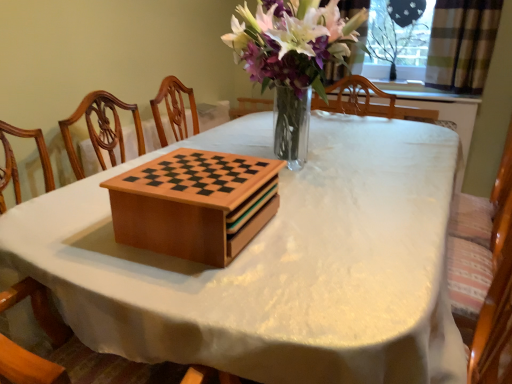
Question: Looking at their shapes, would you say wooden chess set at center is wider or thinner than transparent plastic screen at upper right?

Choices:
 (A) wide
 (B) thin

Answer: (A)

Question: Based on their sizes in the image, would you say wooden chess set at center is bigger or smaller than transparent plastic screen at upper right?

Choices:
 (A) small
 (B) big

Answer: (B)

Question: Estimate the real-world distances between objects in this image. Which object is farther from the transparent plastic screen at upper right?

Choices:
 (A) wooden chessboard at center
 (B) plaid fabric curtain at upper right
 (C) wooden chess set at center

Answer: (A)

Question: Which is nearer to the wooden chessboard at center?

Choices:
 (A) wooden chess set at center
 (B) plaid fabric curtain at upper right
 (C) transparent plastic screen at upper right

Answer: (A)